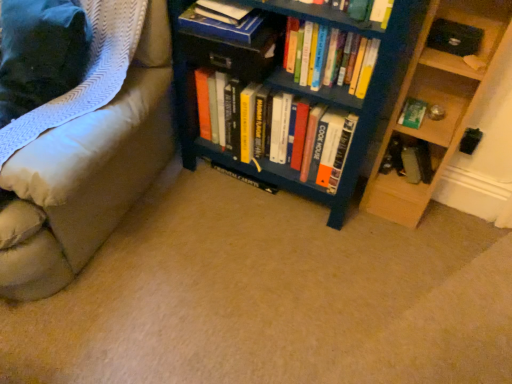
Where is `free spot in front of wooden at right`? free spot in front of wooden at right is located at coordinates (409, 241).